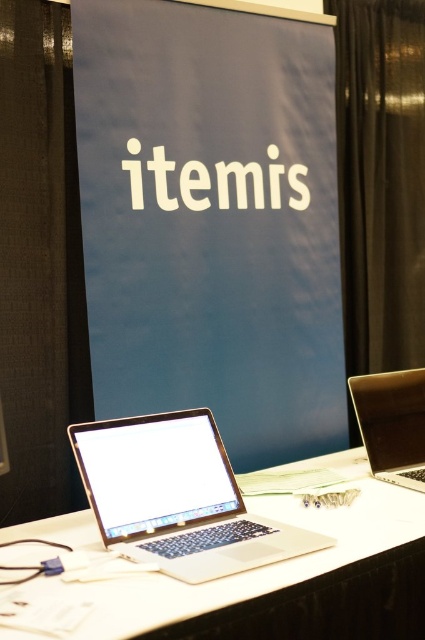
Question: Is the position of blue matte signboard at center less distant than that of satin silver laptop at center?

Choices:
 (A) no
 (B) yes

Answer: (A)

Question: Which object is positioned farthest from the silver metallic laptop at center?

Choices:
 (A) satin silver laptop at center
 (B) white matte laptop at center

Answer: (A)

Question: Which point is closer to the camera taking this photo?

Choices:
 (A) (221, 548)
 (B) (373, 406)
 (C) (149, 209)

Answer: (A)

Question: Which object appears farthest from the camera in this image?

Choices:
 (A) satin silver laptop at center
 (B) blue matte signboard at center
 (C) white matte laptop at center

Answer: (B)

Question: Does blue matte signboard at center appear on the right side of white matte laptop at center?

Choices:
 (A) no
 (B) yes

Answer: (A)

Question: Is white matte laptop at center further to the viewer compared to silver metallic laptop at center?

Choices:
 (A) no
 (B) yes

Answer: (A)